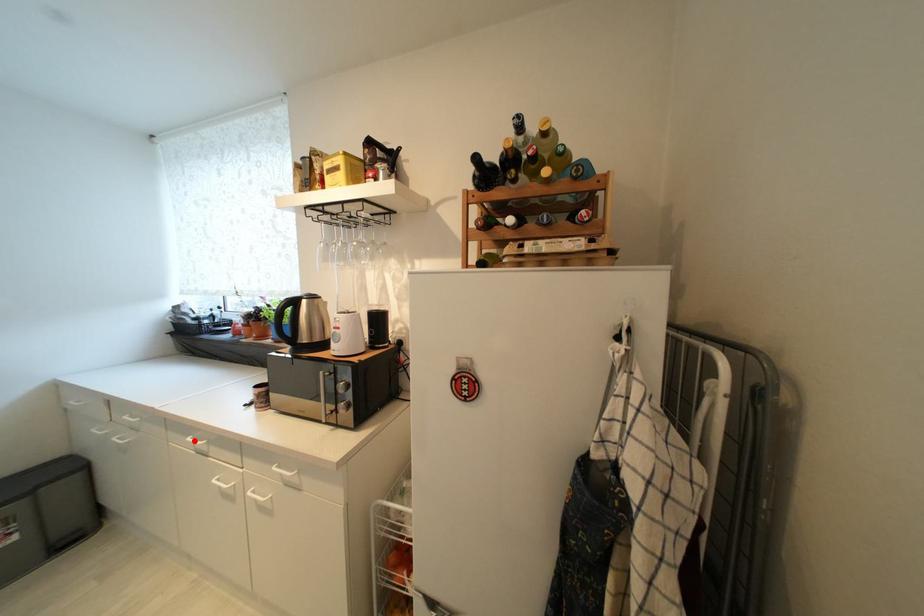
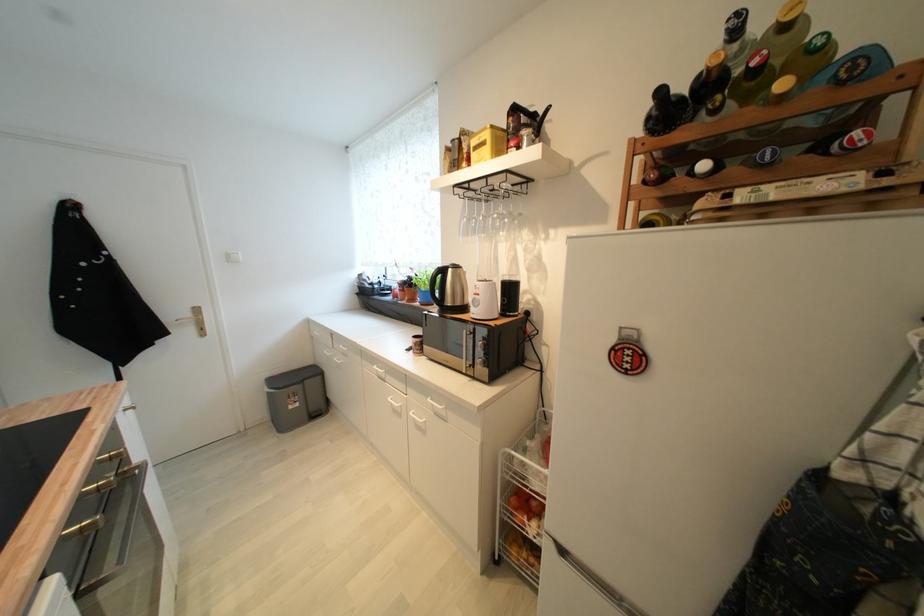
Question: I am providing you with two images of the same scene from different viewpoints. In image1, a red point is highlighted. Considering the same 3D point in image2, which of the following is correct?

Choices:
 (A) It is closer
 (B) It is farther

Answer: (B)